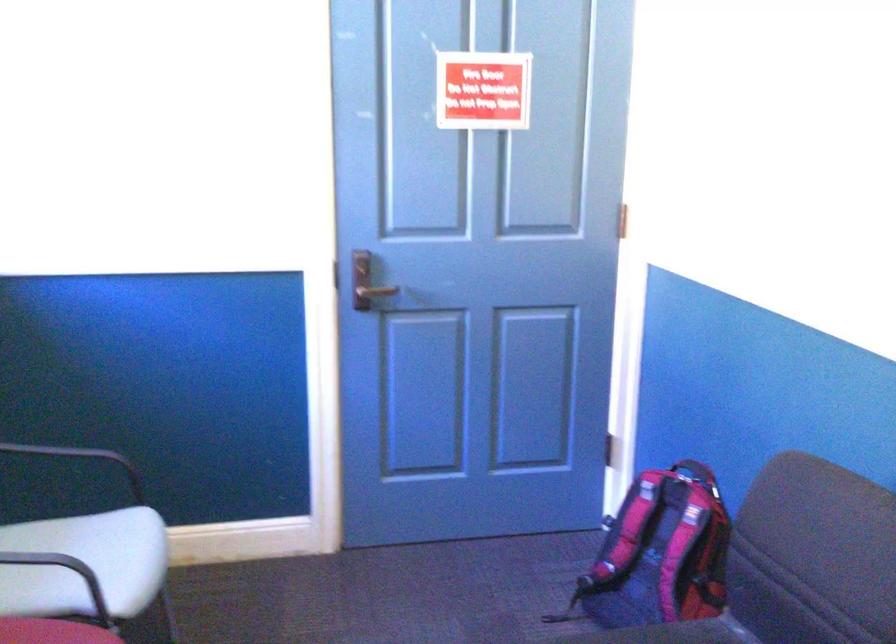
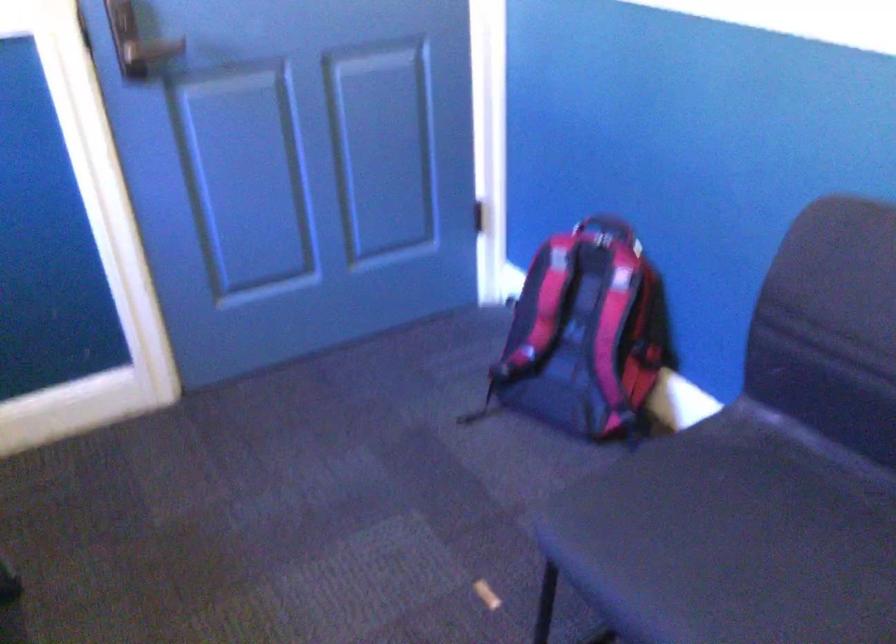
What movement of the cameraman would produce the second image?

The movement direction of the cameraman is left, forward.